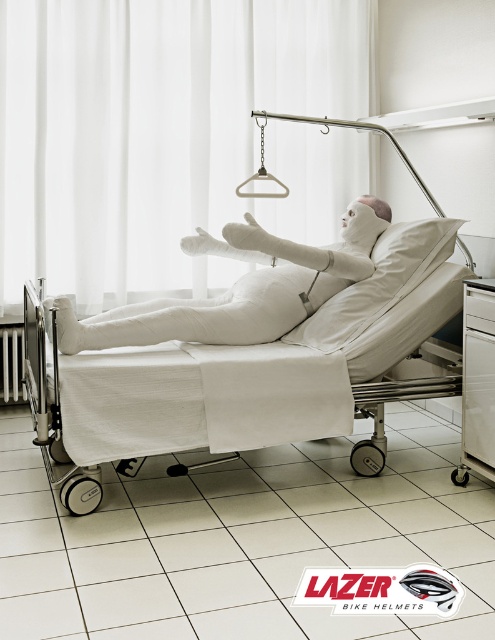
Is point (262, 424) behind point (148, 337)?

No, it is in front of (148, 337).

Who is higher up, white fabric hospital bed at center or white bandaged figure at center?

white bandaged figure at center is higher up.

Is point (351, 259) positioned in front of point (274, 250)?

No, (351, 259) is behind (274, 250).

Find the location of `white fabric hospital bed at center`. white fabric hospital bed at center is located at coordinates (252, 342).

Is white fabric hospital bed at center shorter than white plastic radiator at lower left?

No, white fabric hospital bed at center is not shorter than white plastic radiator at lower left.

Between white fabric hospital bed at center and white plastic radiator at lower left, which one appears on the left side from the viewer's perspective?

white plastic radiator at lower left is more to the left.

Identify the location of white fabric hospital bed at center. This screenshot has height=640, width=495. (252, 342).

This screenshot has width=495, height=640. I want to click on white fabric hospital bed at center, so click(252, 342).

Who is positioned more to the right, white plastic drawer at lower right or white plastic radiator at lower left?

From the viewer's perspective, white plastic drawer at lower right appears more on the right side.

The width and height of the screenshot is (495, 640). Find the location of `white plastic drawer at lower right`. white plastic drawer at lower right is located at coordinates (478, 381).